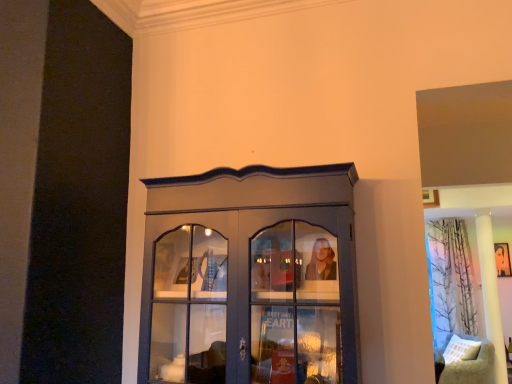
Question: From a real-world perspective, is matte gray cupboard at center positioned over smooth black portrait at upper right based on gravity?

Choices:
 (A) yes
 (B) no

Answer: (B)

Question: Is matte gray cupboard at center looking in the opposite direction of smooth black portrait at upper right?

Choices:
 (A) no
 (B) yes

Answer: (B)

Question: Is matte gray cupboard at center further to the viewer compared to smooth black portrait at upper right?

Choices:
 (A) no
 (B) yes

Answer: (A)

Question: Is matte gray cupboard at center located outside smooth black portrait at upper right?

Choices:
 (A) no
 (B) yes

Answer: (B)

Question: From the image's perspective, is matte gray cupboard at center on top of smooth black portrait at upper right?

Choices:
 (A) yes
 (B) no

Answer: (A)

Question: In terms of width, does beige fabric cushion at lower right look wider or thinner when compared to smooth black portrait at upper right?

Choices:
 (A) wide
 (B) thin

Answer: (A)

Question: From a real-world perspective, is beige fabric cushion at lower right above or below smooth black portrait at upper right?

Choices:
 (A) below
 (B) above

Answer: (A)

Question: Would you say beige fabric cushion at lower right is to the left or to the right of smooth black portrait at upper right in the picture?

Choices:
 (A) left
 (B) right

Answer: (A)

Question: From their relative heights in the image, would you say beige fabric cushion at lower right is taller or shorter than smooth black portrait at upper right?

Choices:
 (A) short
 (B) tall

Answer: (B)

Question: Looking at their shapes, would you say smooth black portrait at upper right is wider or thinner than printed fabric curtain at right?

Choices:
 (A) wide
 (B) thin

Answer: (B)

Question: From the image's perspective, is smooth black portrait at upper right located above or below printed fabric curtain at right?

Choices:
 (A) below
 (B) above

Answer: (B)

Question: Looking at the image, does smooth black portrait at upper right seem bigger or smaller compared to printed fabric curtain at right?

Choices:
 (A) small
 (B) big

Answer: (A)

Question: Is smooth black portrait at upper right spatially inside printed fabric curtain at right, or outside of it?

Choices:
 (A) outside
 (B) inside

Answer: (A)

Question: Is smooth black portrait at upper right situated inside beige fabric cushion at lower right or outside?

Choices:
 (A) inside
 (B) outside

Answer: (B)

Question: Relative to beige fabric cushion at lower right, is smooth black portrait at upper right in front or behind?

Choices:
 (A) behind
 (B) front

Answer: (A)